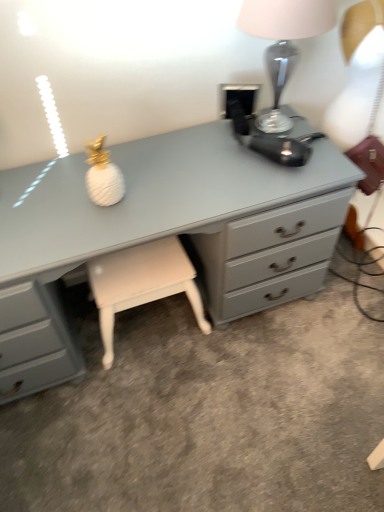
What do you see at coordinates (283, 42) in the screenshot?
I see `satin silver lamp at upper right` at bounding box center [283, 42].

Where is `matte gray chest of drawers at center`? This screenshot has width=384, height=512. matte gray chest of drawers at center is located at coordinates (163, 234).

The image size is (384, 512). In order to click on satin silver lamp at upper right in this screenshot , I will do `click(283, 42)`.

From the picture: From the image's perspective, relative to white leather stool at center, is matte gray chest of drawers at center above or below?

matte gray chest of drawers at center is above white leather stool at center.

Can you confirm if matte gray chest of drawers at center is bigger than white leather stool at center?

Correct, matte gray chest of drawers at center is larger in size than white leather stool at center.

Who is more distant, matte gray chest of drawers at center or white leather stool at center?

white leather stool at center is further from the camera.

Is matte gray chest of drawers at center aimed at white leather stool at center?

Yes, matte gray chest of drawers at center faces towards white leather stool at center.

Is white leather stool at center positioned with its back to satin silver lamp at upper right?

No, white leather stool at center is not facing the opposite direction of satin silver lamp at upper right.

Considering the relative positions of white leather stool at center and satin silver lamp at upper right in the image provided, is white leather stool at center to the right of satin silver lamp at upper right from the viewer's perspective?

In fact, white leather stool at center is to the left of satin silver lamp at upper right.

Where is `table lamp located in front of the white leather stool at center`? table lamp located in front of the white leather stool at center is located at coordinates (283, 42).

Can you confirm if matte gray chest of drawers at center is bigger than satin silver lamp at upper right?

Yes, matte gray chest of drawers at center is bigger than satin silver lamp at upper right.

Is matte gray chest of drawers at center oriented away from satin silver lamp at upper right?

matte gray chest of drawers at center does not have its back to satin silver lamp at upper right.

Is matte gray chest of drawers at center next to satin silver lamp at upper right?

No, matte gray chest of drawers at center is not touching satin silver lamp at upper right.

From the image's perspective, would you say matte gray chest of drawers at center is positioned over satin silver lamp at upper right?

No, from the image's perspective, matte gray chest of drawers at center is not over satin silver lamp at upper right.

Is white leather stool at center not close to matte gray chest of drawers at center?

No, white leather stool at center is in close proximity to matte gray chest of drawers at center.

Where is `stool on the left of matte gray chest of drawers at center`? Image resolution: width=384 pixels, height=512 pixels. stool on the left of matte gray chest of drawers at center is located at coordinates (142, 283).

Is white leather stool at center smaller than matte gray chest of drawers at center?

Yes, white leather stool at center is smaller than matte gray chest of drawers at center.

What's the angular difference between white leather stool at center and matte gray chest of drawers at center's facing directions?

The angle between the facing direction of white leather stool at center and the facing direction of matte gray chest of drawers at center is 0.00035 degrees.

This screenshot has height=512, width=384. I want to click on stool behind the satin silver lamp at upper right, so click(x=142, y=283).

Is satin silver lamp at upper right completely or partially outside of white leather stool at center?

Absolutely, satin silver lamp at upper right is external to white leather stool at center.

Considering the relative sizes of satin silver lamp at upper right and white leather stool at center in the image provided, is satin silver lamp at upper right bigger than white leather stool at center?

Actually, satin silver lamp at upper right might be smaller than white leather stool at center.

From a real-world perspective, between satin silver lamp at upper right and matte gray chest of drawers at center, who is vertically lower?

matte gray chest of drawers at center.

From the image's perspective, is satin silver lamp at upper right beneath matte gray chest of drawers at center?

Incorrect, from the image's perspective, satin silver lamp at upper right is higher than matte gray chest of drawers at center.

Is point (316, 17) in front of point (5, 282)?

No, it is behind (5, 282).

Is satin silver lamp at upper right turned away from matte gray chest of drawers at center?

No, satin silver lamp at upper right is not facing the opposite direction of matte gray chest of drawers at center.

Locate an element on the screen. The height and width of the screenshot is (512, 384). chest of drawers on the right of white leather stool at center is located at coordinates (163, 234).

Locate an element on the screen. stool behind the satin silver lamp at upper right is located at coordinates (142, 283).

When comparing their distances from matte gray chest of drawers at center, does satin silver lamp at upper right or white leather stool at center seem closer?

white leather stool at center is closer to matte gray chest of drawers at center.

Considering their positions, is satin silver lamp at upper right positioned further to white leather stool at center than matte gray chest of drawers at center?

satin silver lamp at upper right.

Looking at the image, which one is located further to white leather stool at center, matte gray chest of drawers at center or satin silver lamp at upper right?

satin silver lamp at upper right is further to white leather stool at center.

Based on their spatial positions, is white leather stool at center or satin silver lamp at upper right further from matte gray chest of drawers at center?

Among the two, satin silver lamp at upper right is located further to matte gray chest of drawers at center.

Based on their spatial positions, is matte gray chest of drawers at center or white leather stool at center closer to satin silver lamp at upper right?

matte gray chest of drawers at center lies closer to satin silver lamp at upper right than the other object.

Which object lies further to the anchor point satin silver lamp at upper right, white leather stool at center or matte gray chest of drawers at center?

white leather stool at center is further to satin silver lamp at upper right.

The width and height of the screenshot is (384, 512). Find the location of `chest of drawers between satin silver lamp at upper right and white leather stool at center in the up-down direction`. chest of drawers between satin silver lamp at upper right and white leather stool at center in the up-down direction is located at coordinates (163, 234).